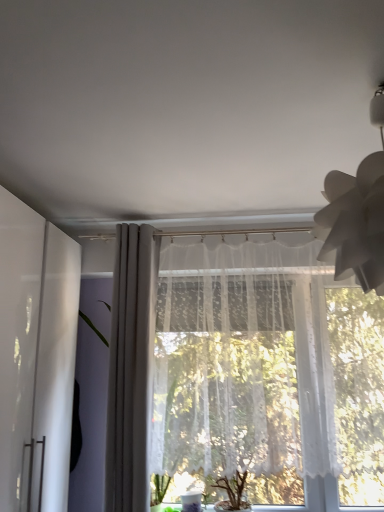
Image resolution: width=384 pixels, height=512 pixels. What do you see at coordinates (191, 501) in the screenshot? I see `transparent glass vase at lower center` at bounding box center [191, 501].

Describe the element at coordinates (356, 215) in the screenshot. The width and height of the screenshot is (384, 512). I see `white paper lampshade at upper right` at that location.

At what (x,y) coordinates should I click in order to perform the action: click on white sheer curtain at center, the 2th curtain when ordered from right to left. Please return your answer as a coordinate pair (x, y). Image resolution: width=384 pixels, height=512 pixels. Looking at the image, I should click on (131, 368).

This screenshot has height=512, width=384. Find the location of `transparent glass vase at lower center`. transparent glass vase at lower center is located at coordinates (191, 501).

From a real-world perspective, which object rests below the other?

In real-world perspective, white sheer curtain at center, positioned as the 1th curtain in left-to-right order, is lower.

Is white sheer curtain at center, positioned as the 1th curtain in left-to-right order, behind white paper lampshade at upper right?

Yes, white sheer curtain at center, positioned as the 1th curtain in left-to-right order, is behind white paper lampshade at upper right.

Based on the photo, is white sheer curtain at center, the 2th curtain when ordered from right to left, far from white paper lampshade at upper right?

Absolutely, white sheer curtain at center, the 2th curtain when ordered from right to left, is distant from white paper lampshade at upper right.

Between white lace curtain at center, positioned as the 2th curtain in left-to-right order, and white sheer curtain at center, positioned as the 1th curtain in left-to-right order, which one has less height?

white sheer curtain at center, positioned as the 1th curtain in left-to-right order.

Considering the positions of points (149, 459) and (150, 401), is point (149, 459) farther from camera compared to point (150, 401)?

No, (149, 459) is closer to viewer.

Can you confirm if white lace curtain at center, which is the 1th curtain in right-to-left order, is smaller than white sheer curtain at center, positioned as the 1th curtain in left-to-right order?

Actually, white lace curtain at center, which is the 1th curtain in right-to-left order, might be larger than white sheer curtain at center, positioned as the 1th curtain in left-to-right order.

Would you say white lace curtain at center, positioned as the 2th curtain in left-to-right order, is a long distance from white sheer curtain at center, positioned as the 1th curtain in left-to-right order?

No, there isn't a large distance between white lace curtain at center, positioned as the 2th curtain in left-to-right order, and white sheer curtain at center, positioned as the 1th curtain in left-to-right order.

I want to click on glass vase on the left of white paper lampshade at upper right, so click(x=191, y=501).

In the scene shown: How many degrees apart are the facing directions of transparent glass vase at lower center and white paper lampshade at upper right?

The facing directions of transparent glass vase at lower center and white paper lampshade at upper right are 0.00163 degrees apart.

Which is in front, transparent glass vase at lower center or white paper lampshade at upper right?

white paper lampshade at upper right.

Is transparent glass vase at lower center far from white paper lampshade at upper right?

Yes, transparent glass vase at lower center and white paper lampshade at upper right are quite far apart.

Considering their positions, is white sheer curtain at center, positioned as the 1th curtain in left-to-right order, located in front of or behind white glossy cabinet at left?

In the image, white sheer curtain at center, positioned as the 1th curtain in left-to-right order, appears behind white glossy cabinet at left.

Between point (128, 284) and point (34, 216), which one is positioned in front?

The point (34, 216) is closer.

Is white sheer curtain at center, the 2th curtain when ordered from right to left, aimed at white glossy cabinet at left?

No, white sheer curtain at center, the 2th curtain when ordered from right to left, is not turned towards white glossy cabinet at left.

Measure the distance between white sheer curtain at center, positioned as the 1th curtain in left-to-right order, and white glossy cabinet at left.

white sheer curtain at center, positioned as the 1th curtain in left-to-right order, is 15.18 inches from white glossy cabinet at left.

Is transparent glass vase at lower center surrounded by white lace curtain at center, positioned as the 2th curtain in left-to-right order?

That's incorrect, transparent glass vase at lower center is not inside white lace curtain at center, positioned as the 2th curtain in left-to-right order.

Are white lace curtain at center, which is the 1th curtain in right-to-left order, and transparent glass vase at lower center making contact?

white lace curtain at center, which is the 1th curtain in right-to-left order, is not next to transparent glass vase at lower center, and they're not touching.

Which is more to the right, white lace curtain at center, positioned as the 2th curtain in left-to-right order, or transparent glass vase at lower center?

white lace curtain at center, positioned as the 2th curtain in left-to-right order, is more to the right.

From a real-world perspective, who is located higher, white lace curtain at center, which is the 1th curtain in right-to-left order, or transparent glass vase at lower center?

white lace curtain at center, which is the 1th curtain in right-to-left order.

Is white glossy cabinet at left at the left side of white sheer curtain at center, the 2th curtain when ordered from right to left?

Yes.

Does white glossy cabinet at left have a greater height compared to white sheer curtain at center, positioned as the 1th curtain in left-to-right order?

No.

Who is more distant, white glossy cabinet at left or white sheer curtain at center, the 2th curtain when ordered from right to left?

white sheer curtain at center, the 2th curtain when ordered from right to left, is further away from the camera.

Which object is thinner, white glossy cabinet at left or white sheer curtain at center, the 2th curtain when ordered from right to left?

white sheer curtain at center, the 2th curtain when ordered from right to left, is thinner.

Is white lace curtain at center, positioned as the 2th curtain in left-to-right order, facing towards white glossy cabinet at left?

No, white lace curtain at center, positioned as the 2th curtain in left-to-right order, does not turn towards white glossy cabinet at left.

From the white glossy cabinet at left, count 1st curtains backward and point to it. Please provide its 2D coordinates.

[(223, 361)]

Which of these two, white lace curtain at center, positioned as the 2th curtain in left-to-right order, or white glossy cabinet at left, is wider?

Wider between the two is white glossy cabinet at left.

The height and width of the screenshot is (512, 384). In the image, there is a white sheer curtain at center, the 2th curtain when ordered from right to left. Find the location of `lamp above it (from the image's perspective)`. lamp above it (from the image's perspective) is located at coordinates (356, 215).

Image resolution: width=384 pixels, height=512 pixels. What are the coordinates of `curtain that is under the white sheer curtain at center, the 2th curtain when ordered from right to left (from a real-world perspective)` in the screenshot? It's located at (223, 361).

Based on their spatial positions, is white paper lampshade at upper right or white sheer curtain at center, positioned as the 1th curtain in left-to-right order, closer to transparent glass vase at lower center?

white sheer curtain at center, positioned as the 1th curtain in left-to-right order, is closer to transparent glass vase at lower center.

From the image, which object appears to be farther from white paper lampshade at upper right, white sheer curtain at center, positioned as the 1th curtain in left-to-right order, or transparent glass vase at lower center?

Based on the image, transparent glass vase at lower center appears to be further to white paper lampshade at upper right.

Considering their positions, is white glossy cabinet at left positioned further to white sheer curtain at center, positioned as the 1th curtain in left-to-right order, than transparent glass vase at lower center?

Based on the image, transparent glass vase at lower center appears to be further to white sheer curtain at center, positioned as the 1th curtain in left-to-right order.

When comparing their distances from transparent glass vase at lower center, does white glossy cabinet at left or white paper lampshade at upper right seem further?

white paper lampshade at upper right is further to transparent glass vase at lower center.

From the image, which object appears to be nearer to white sheer curtain at center, positioned as the 1th curtain in left-to-right order, white lace curtain at center, which is the 1th curtain in right-to-left order, or white glossy cabinet at left?

white lace curtain at center, which is the 1th curtain in right-to-left order, lies closer to white sheer curtain at center, positioned as the 1th curtain in left-to-right order, than the other object.

Looking at the image, which one is located closer to white sheer curtain at center, the 2th curtain when ordered from right to left, transparent glass vase at lower center or white lace curtain at center, positioned as the 2th curtain in left-to-right order?

Based on the image, white lace curtain at center, positioned as the 2th curtain in left-to-right order, appears to be nearer to white sheer curtain at center, the 2th curtain when ordered from right to left.

Looking at the image, which one is located closer to white lace curtain at center, which is the 1th curtain in right-to-left order, white sheer curtain at center, the 2th curtain when ordered from right to left, or white paper lampshade at upper right?

white sheer curtain at center, the 2th curtain when ordered from right to left, lies closer to white lace curtain at center, which is the 1th curtain in right-to-left order, than the other object.

Looking at the image, which one is located closer to transparent glass vase at lower center, white sheer curtain at center, positioned as the 1th curtain in left-to-right order, or white paper lampshade at upper right?

Among the two, white sheer curtain at center, positioned as the 1th curtain in left-to-right order, is located nearer to transparent glass vase at lower center.

Identify the location of curtain located between white glossy cabinet at left and white lace curtain at center, positioned as the 2th curtain in left-to-right order, in the left-right direction. The width and height of the screenshot is (384, 512). (131, 368).

At what (x,y) coordinates should I click in order to perform the action: click on curtain between white paper lampshade at upper right and white sheer curtain at center, the 2th curtain when ordered from right to left, from front to back. Please return your answer as a coordinate pair (x, y). Looking at the image, I should click on (223, 361).

I want to click on curtain between white lace curtain at center, positioned as the 2th curtain in left-to-right order, and transparent glass vase at lower center vertically, so click(x=131, y=368).

Where is `glass vase between white glossy cabinet at left and white lace curtain at center, positioned as the 2th curtain in left-to-right order, in the horizontal direction`? glass vase between white glossy cabinet at left and white lace curtain at center, positioned as the 2th curtain in left-to-right order, in the horizontal direction is located at coordinates (191, 501).